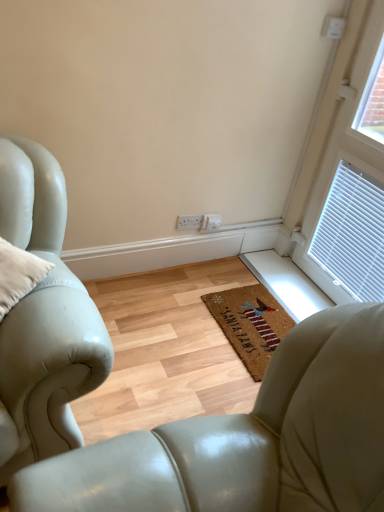
Locate an element on the screen. This screenshot has width=384, height=512. free space to the back side of coir mat at center is located at coordinates (253, 272).